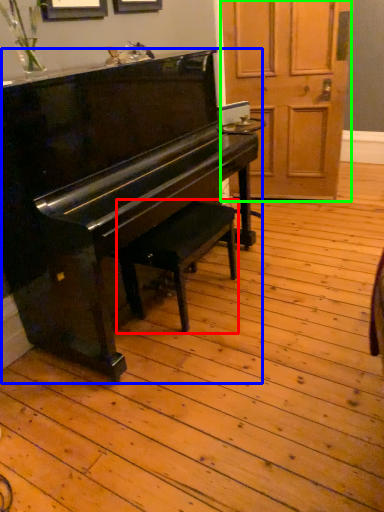
Question: Estimate the real-world distances between objects in this image. Which object is farther from music stool (highlighted by a red box), piano (highlighted by a blue box) or screen door (highlighted by a green box)?

Choices:
 (A) piano
 (B) screen door

Answer: (B)